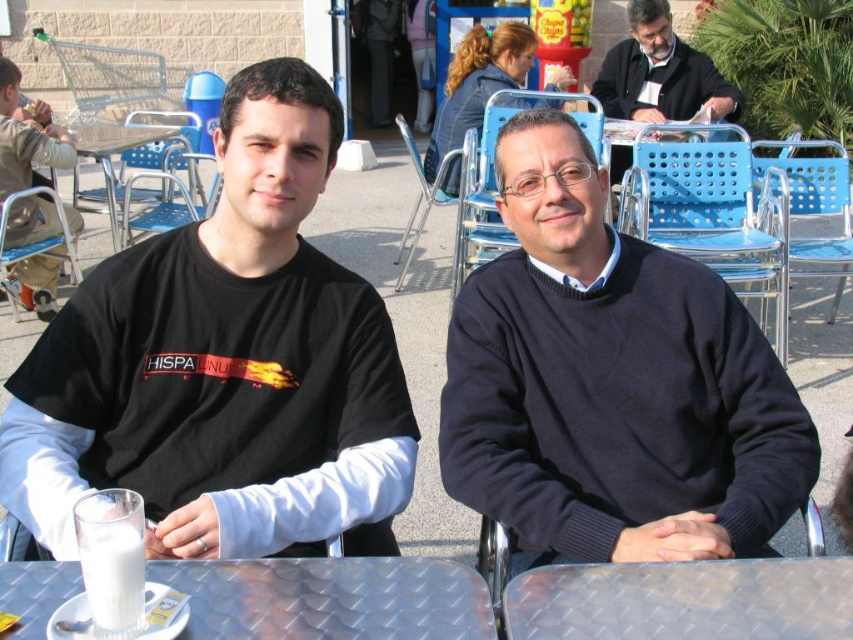
Question: Can you confirm if black matte t-shirt at left is positioned above clear glass table at center?

Choices:
 (A) yes
 (B) no

Answer: (A)

Question: Which object is farther from the camera taking this photo?

Choices:
 (A) white frothy milk at table left
 (B) khaki cotton pants at lower left

Answer: (B)

Question: Can you confirm if clear glass table at center is positioned to the left of khaki cotton pants at lower left?

Choices:
 (A) yes
 (B) no

Answer: (B)

Question: Estimate the real-world distances between objects in this image. Which object is closer to the white frothy milk at table left?

Choices:
 (A) black matte t-shirt at left
 (B) clear glass table at center
 (C) dark blue sweater at center

Answer: (B)

Question: Is clear glass table at center above khaki cotton pants at lower left?

Choices:
 (A) yes
 (B) no

Answer: (B)

Question: Which of the following is the farthest from the observer?

Choices:
 (A) dark blue sweater at center
 (B) black matte t-shirt at left
 (C) dark blue sweater at upper right
 (D) metallic diamond plate table at center

Answer: (C)